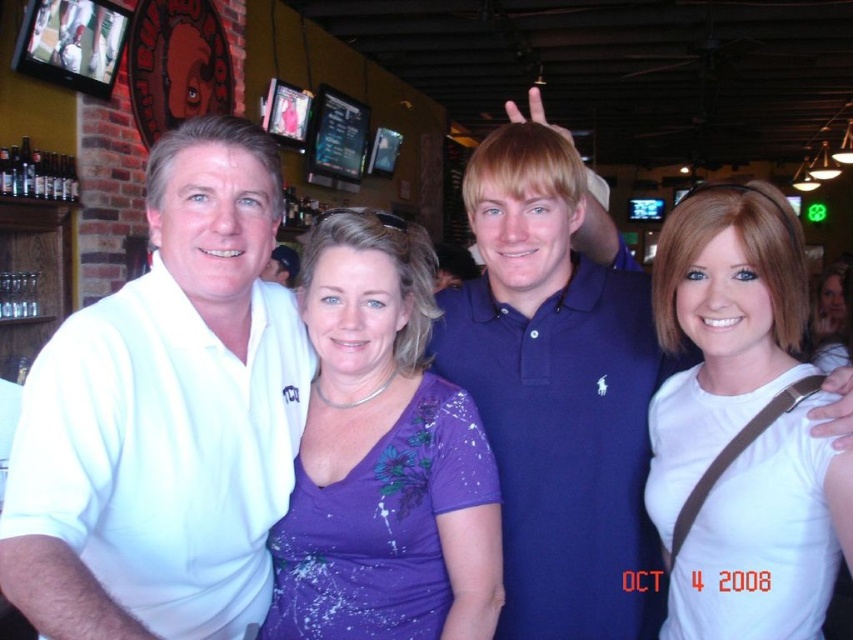
Does blue cotton polo shirt at center appear on the left side of purple matte shirt at center?

No, blue cotton polo shirt at center is not to the left of purple matte shirt at center.

Is blue cotton polo shirt at center positioned behind purple matte shirt at center?

Yes, it is.

Locate an element on the screen. The width and height of the screenshot is (853, 640). blue cotton polo shirt at center is located at coordinates (556, 396).

Locate an element on the screen. The width and height of the screenshot is (853, 640). blue cotton polo shirt at center is located at coordinates (556, 396).

Between blue cotton polo shirt at center and white matte shirt at center, which one appears on the right side from the viewer's perspective?

white matte shirt at center is more to the right.

Between blue cotton polo shirt at center and white matte shirt at center, which one is positioned lower?

white matte shirt at center

Does point (547, 214) lie in front of point (785, 308)?

No, it is not.

Locate an element on the screen. The image size is (853, 640). blue cotton polo shirt at center is located at coordinates (556, 396).

Does white matte polo shirt at left have a lesser width compared to blue cotton polo shirt at center?

Indeed, white matte polo shirt at left has a lesser width compared to blue cotton polo shirt at center.

Is white matte polo shirt at left wider than blue cotton polo shirt at center?

In fact, white matte polo shirt at left might be narrower than blue cotton polo shirt at center.

Does point (76, 497) come in front of point (550, 163)?

Yes.

Identify the location of white matte polo shirt at left. This screenshot has width=853, height=640. (165, 417).